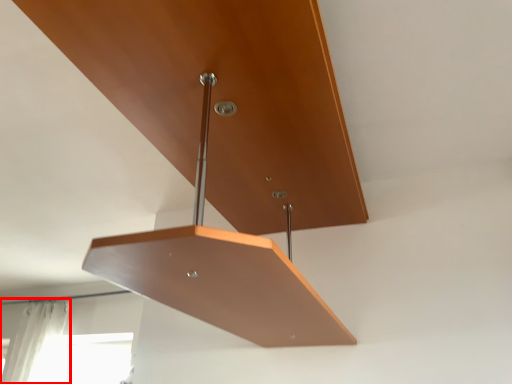
Question: From the image's perspective, where is curtain (annotated by the red box) located in relation to furniture in the image?

Choices:
 (A) above
 (B) below

Answer: (B)